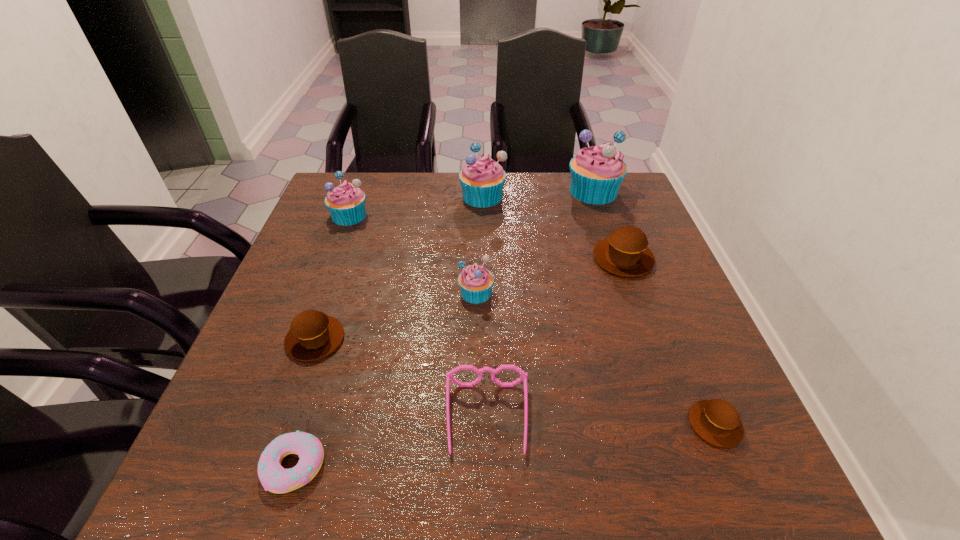
The width and height of the screenshot is (960, 540). In order to click on free space located on the front of the biggest brown muffin in this screenshot , I will do `click(655, 346)`.

What are the coordinates of `free location located on the front of the leftmost brown muffin` in the screenshot? It's located at (286, 424).

The width and height of the screenshot is (960, 540). What are the coordinates of `blank area located on the left of the nearest brown muffin` in the screenshot? It's located at (588, 424).

Locate an element on the screen. This screenshot has width=960, height=540. vacant area located 0.370m on the right of the shortest object is located at coordinates (550, 466).

Locate an element on the screen. This screenshot has height=540, width=960. spectacles that is positioned at the near edge is located at coordinates (523, 376).

You are a GUI agent. You are given a task and a screenshot of the screen. Output one action in this format:
    pyautogui.click(x=<x>, y=<y>)
    Task: Click on the muffin positioned at the near edge
    This screenshot has width=960, height=540.
    Given the screenshot: What is the action you would take?
    pyautogui.click(x=716, y=421)

Identify the location of doughnut situated at the near edge. (274, 478).

Locate an element on the screen. The width and height of the screenshot is (960, 540). doughnut located in the left edge section of the desktop is located at coordinates [274, 478].

Where is `object at the far left corner`? The height and width of the screenshot is (540, 960). object at the far left corner is located at coordinates click(346, 203).

Image resolution: width=960 pixels, height=540 pixels. I want to click on object that is positioned at the near left corner, so click(274, 478).